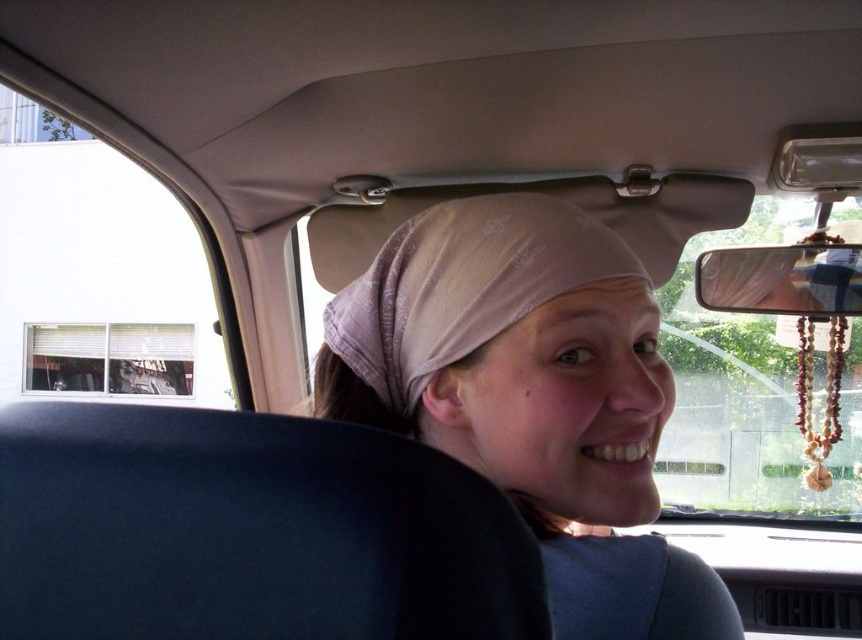
Question: Among these objects, which one is nearest to the camera?

Choices:
 (A) dark blue fabric at center
 (B) pink fabric headscarf at center

Answer: (A)

Question: Does dark blue fabric at center have a lesser width compared to pink fabric headscarf at center?

Choices:
 (A) yes
 (B) no

Answer: (A)

Question: Which of the following is the farthest from the observer?

Choices:
 (A) translucent glass car window at right
 (B) pale pink sheer fabric headscarf at center
 (C) brown wooden beads at right
 (D) pink fabric headscarf at center

Answer: (A)

Question: Is dark blue fabric at center wider than translucent glass car window at right?

Choices:
 (A) yes
 (B) no

Answer: (B)

Question: Does translucent glass car window at right have a greater width compared to pale pink sheer fabric headscarf at center?

Choices:
 (A) no
 (B) yes

Answer: (B)

Question: Which point is farther to the camera?

Choices:
 (A) (842, 333)
 (B) (628, 582)

Answer: (A)